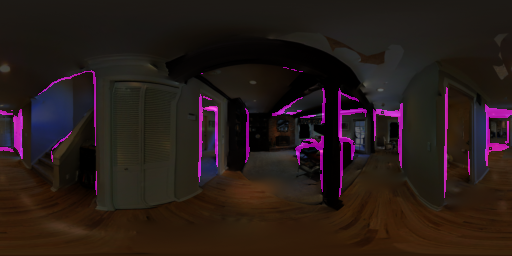
I want to click on toilet paper, so click(x=462, y=150).